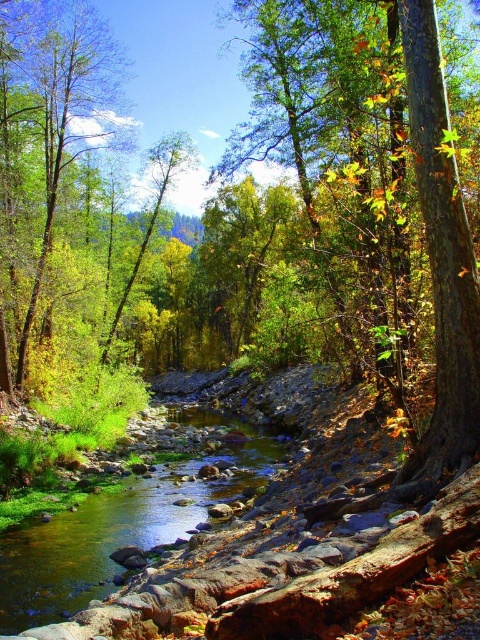
Question: Does clear water at stream center appear over green leafy tree at center?

Choices:
 (A) no
 (B) yes

Answer: (A)

Question: Which point appears closest to the camera in this image?

Choices:
 (A) (93, 545)
 (B) (180, 170)

Answer: (A)

Question: Does clear water at stream center appear over green leafy tree at center?

Choices:
 (A) yes
 (B) no

Answer: (B)

Question: Is clear water at stream center bigger than green leafy tree at center?

Choices:
 (A) no
 (B) yes

Answer: (A)

Question: Which of the following is the closest to the observer?

Choices:
 (A) (160, 141)
 (B) (96, 506)

Answer: (B)